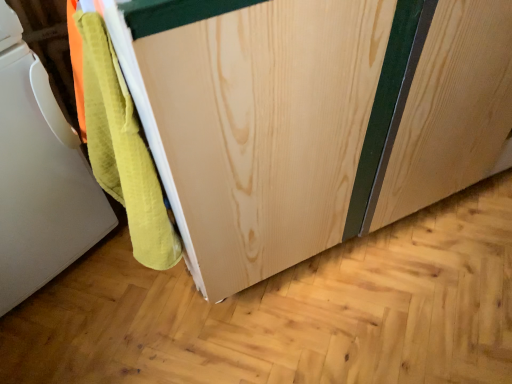
Where is `white matte towel at lower left`? This screenshot has height=384, width=512. white matte towel at lower left is located at coordinates (40, 176).

Describe the element at coordinates (40, 176) in the screenshot. This screenshot has width=512, height=384. I see `white matte towel at lower left` at that location.

Measure the distance between natural wood cabinet at center and camera.

They are 16.33 inches apart.

The height and width of the screenshot is (384, 512). What do you see at coordinates (311, 117) in the screenshot? I see `natural wood cabinet at center` at bounding box center [311, 117].

You are a GUI agent. You are given a task and a screenshot of the screen. Output one action in this format:
    pyautogui.click(x=<x>, y=<y>)
    Task: Click on the natural wood cabinet at center
    This screenshot has width=512, height=384.
    Given the screenshot: What is the action you would take?
    pyautogui.click(x=311, y=117)

Find the location of a particular element. white matte towel at lower left is located at coordinates (40, 176).

Is natural wood cabinet at center at the left side of white matte towel at lower left?

No, natural wood cabinet at center is not to the left of white matte towel at lower left.

Between natural wood cabinet at center and white matte towel at lower left, which one is positioned behind?

white matte towel at lower left is behind.

Is point (332, 19) more distant than point (13, 103)?

No, it is in front of (13, 103).

From the image's perspective, does natural wood cabinet at center appear lower than white matte towel at lower left?

No, from the image's perspective, natural wood cabinet at center is not below white matte towel at lower left.

From a real-world perspective, is natural wood cabinet at center above or below white matte towel at lower left?

From a real-world perspective, natural wood cabinet at center is physically below white matte towel at lower left.

Which object is thinner, natural wood cabinet at center or white matte towel at lower left?

white matte towel at lower left.

Considering the sizes of objects natural wood cabinet at center and white matte towel at lower left in the image provided, who is taller, natural wood cabinet at center or white matte towel at lower left?

Standing taller between the two is natural wood cabinet at center.

Considering the relative sizes of natural wood cabinet at center and white matte towel at lower left in the image provided, is natural wood cabinet at center bigger than white matte towel at lower left?

Yes.

Is white matte towel at lower left completely or partially inside natural wood cabinet at center?

Definitely not — white matte towel at lower left is not inside natural wood cabinet at center.

Is natural wood cabinet at center positioned far away from white matte towel at lower left?

No, natural wood cabinet at center is not far away from white matte towel at lower left.

Is natural wood cabinet at center oriented away from white matte towel at lower left?

No, natural wood cabinet at center is not facing the opposite direction of white matte towel at lower left.

What's the angular difference between natural wood cabinet at center and white matte towel at lower left's facing directions?

The facing directions of natural wood cabinet at center and white matte towel at lower left are 1.81 degrees apart.

Consider the image. Measure the distance from natural wood cabinet at center to white matte towel at lower left.

natural wood cabinet at center is 18.87 inches from white matte towel at lower left.

This screenshot has height=384, width=512. Find the location of `home appliance below the natural wood cabinet at center (from the image's perspective)`. home appliance below the natural wood cabinet at center (from the image's perspective) is located at coordinates (40, 176).

Can you confirm if white matte towel at lower left is positioned to the left of natural wood cabinet at center?

Yes, white matte towel at lower left is to the left of natural wood cabinet at center.

Is white matte towel at lower left in front of or behind natural wood cabinet at center in the image?

In the image, white matte towel at lower left appears behind natural wood cabinet at center.

Considering the points (20, 160) and (215, 184), which point is behind, point (20, 160) or point (215, 184)?

The point (20, 160) is farther.

From the image's perspective, is white matte towel at lower left on natural wood cabinet at center?

No.

From a real-world perspective, which object rests below the other?

In real-world perspective, natural wood cabinet at center is lower.

Does white matte towel at lower left have a lesser width compared to natural wood cabinet at center?

Indeed, white matte towel at lower left has a lesser width compared to natural wood cabinet at center.

Which of these two, white matte towel at lower left or natural wood cabinet at center, stands shorter?

white matte towel at lower left.

Can you confirm if white matte towel at lower left is smaller than natural wood cabinet at center?

Correct, white matte towel at lower left occupies less space than natural wood cabinet at center.

Choose the correct answer: Is white matte towel at lower left inside natural wood cabinet at center or outside it?

white matte towel at lower left is not inside natural wood cabinet at center, it's outside.

Looking at this image, are white matte towel at lower left and natural wood cabinet at center far apart?

No, white matte towel at lower left is not far away from natural wood cabinet at center.

Is white matte towel at lower left facing away from natural wood cabinet at center?

white matte towel at lower left does not have its back to natural wood cabinet at center.

How different are the orientations of white matte towel at lower left and natural wood cabinet at center in degrees?

1.81 degrees.

How far apart are white matte towel at lower left and natural wood cabinet at center?

47.93 centimeters.

At what (x,y) coordinates should I click in order to perform the action: click on cabinetry beneath the white matte towel at lower left (from a real-world perspective). Please return your answer as a coordinate pair (x, y). This screenshot has width=512, height=384. Looking at the image, I should click on (311, 117).

Where is `cabinetry located on the right of white matte towel at lower left`? The width and height of the screenshot is (512, 384). cabinetry located on the right of white matte towel at lower left is located at coordinates (311, 117).

Locate an element on the screen. home appliance on the left of natural wood cabinet at center is located at coordinates (40, 176).